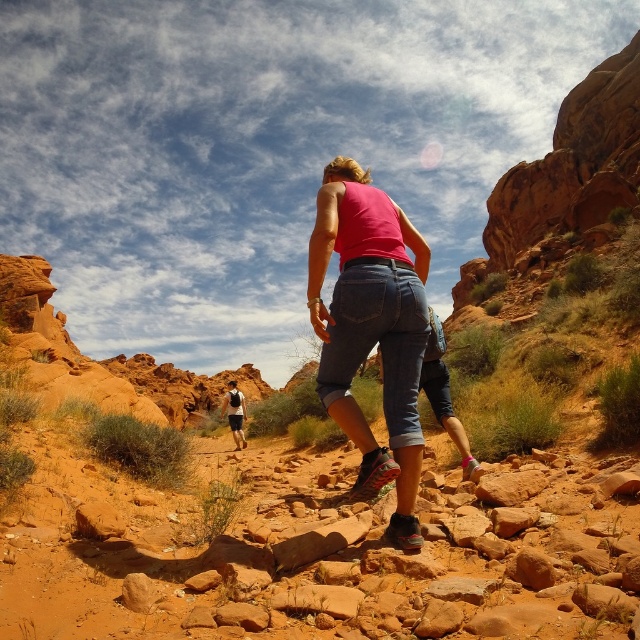
Question: Does matte pink tank top at center have a smaller size compared to white mesh shirt at center?

Choices:
 (A) no
 (B) yes

Answer: (B)

Question: Which object appears closest to the camera in this image?

Choices:
 (A) white mesh shirt at center
 (B) matte pink tank top at center

Answer: (B)

Question: In this image, where is matte pink tank top at center located relative to white mesh shirt at center?

Choices:
 (A) right
 (B) left

Answer: (A)

Question: Is matte pink tank top at center to the right of white mesh shirt at center from the viewer's perspective?

Choices:
 (A) yes
 (B) no

Answer: (A)